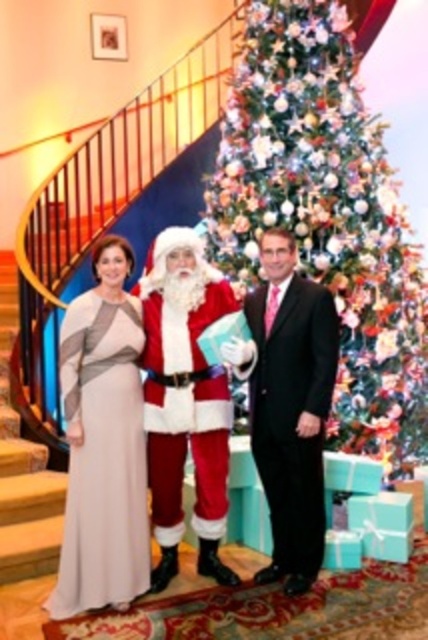
Question: Is silky white dress at center in front of satin beige dress at left?

Choices:
 (A) no
 (B) yes

Answer: (A)

Question: Is fuzzy red santa at center below black suit at center?

Choices:
 (A) yes
 (B) no

Answer: (A)

Question: Which of the following is the farthest from the observer?

Choices:
 (A) 285,236
 (B) 318,61
 (C) 118,314

Answer: (B)

Question: Which of the following is the closest to the observer?

Choices:
 (A) (219, 209)
 (B) (14, 468)

Answer: (B)

Question: Which point is closer to the camera?

Choices:
 (A) (5, 502)
 (B) (309, 28)
 (C) (146, 550)
 (D) (299, 580)

Answer: (C)

Question: Does silky white dress at center appear over fuzzy red santa at center?

Choices:
 (A) no
 (B) yes

Answer: (A)